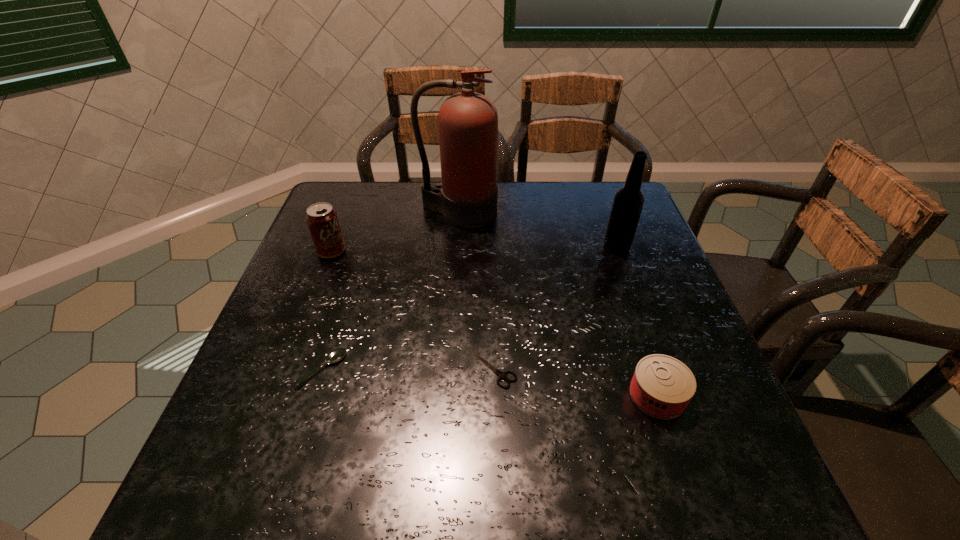
The height and width of the screenshot is (540, 960). Identify the location of free space that satisfies the following two spatial constraints: 1. at the nozzle of the fire extinguisher; 2. on the right side of the shears. (448, 369).

Find the location of a particular element. free spot that satisfies the following two spatial constraints: 1. on the back side of the beer bottle; 2. on the left side of the can is located at coordinates (608, 247).